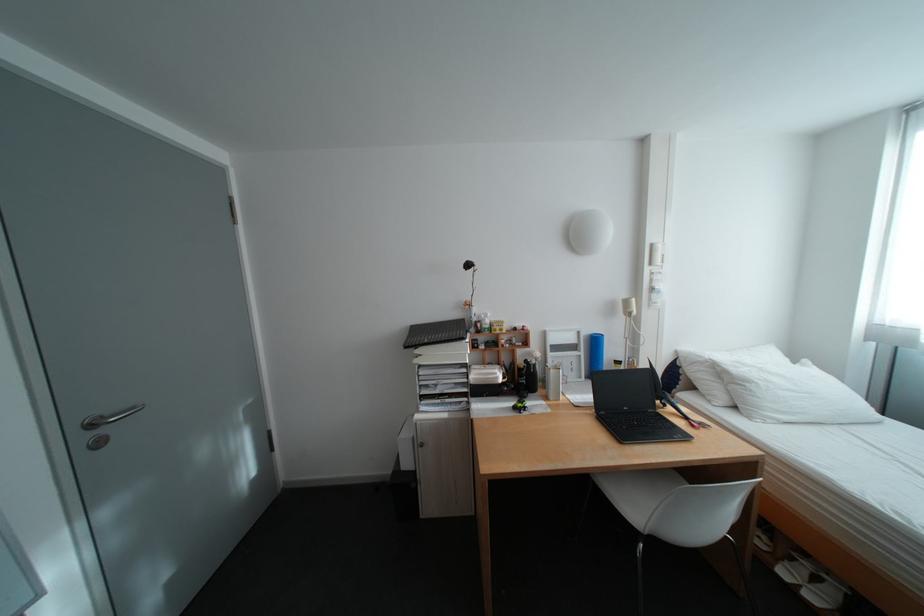
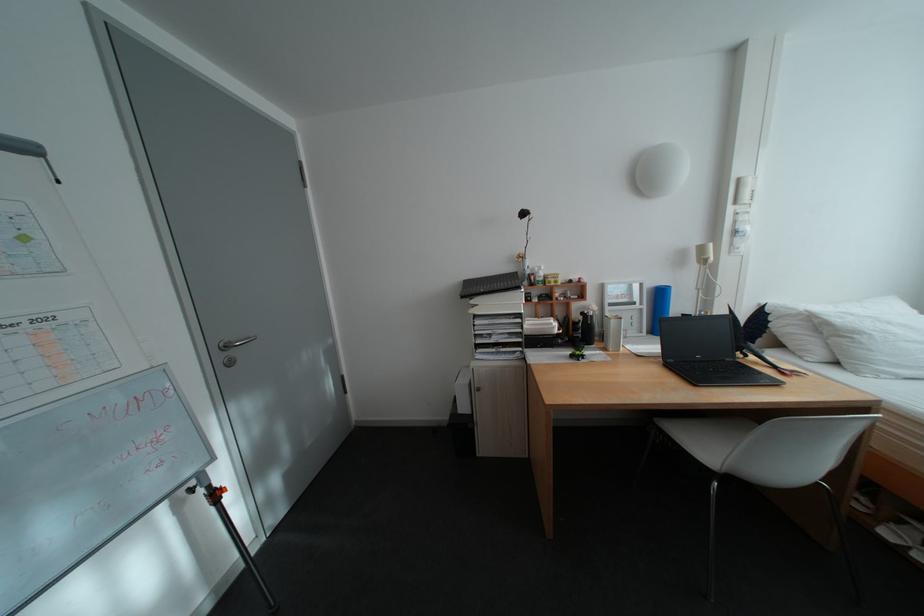
Question: Which direction would the cameraman need to move to produce the second image? Reply with the corresponding letter.

Choices:
 (A) Left
 (B) Right
 (C) Forward
 (D) Backward

Answer: (A)